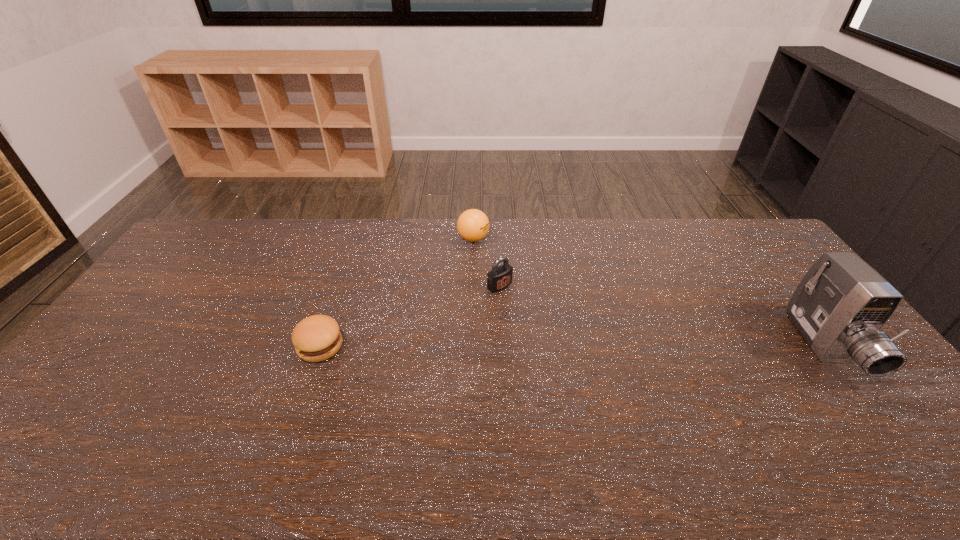
At what (x,y) coordinates should I click in order to perform the action: click on free space located on the front of the padlock near the keyhole. Please return your answer as a coordinate pair (x, y). The image size is (960, 540). Looking at the image, I should click on (564, 338).

Locate an element on the screen. The image size is (960, 540). blank space located 0.350m on the side with brand of the farthest object is located at coordinates (550, 299).

Find the location of a particular element. This screenshot has width=960, height=540. vacant region located on the side with brand of the farthest object is located at coordinates (516, 272).

Locate an element on the screen. vacant space located on the side with brand of the farthest object is located at coordinates (527, 281).

Where is `object located in the far edge section of the desktop`? object located in the far edge section of the desktop is located at coordinates (473, 225).

I want to click on object that is positioned at the right edge, so click(839, 307).

Locate an element on the screen. free space at the far edge of the desktop is located at coordinates (567, 227).

At what (x,y) coordinates should I click in order to perform the action: click on vacant space at the near edge of the desktop. Please return your answer as a coordinate pair (x, y). This screenshot has width=960, height=540. Looking at the image, I should click on (581, 412).

The width and height of the screenshot is (960, 540). In the image, there is a desktop. Find the location of `free space at the left edge`. free space at the left edge is located at coordinates (113, 358).

You are a GUI agent. You are given a task and a screenshot of the screen. Output one action in this format:
    pyautogui.click(x=<x>, y=<y>)
    Task: Click on the free space at the far left corner of the desktop
    
    Given the screenshot: What is the action you would take?
    227,237